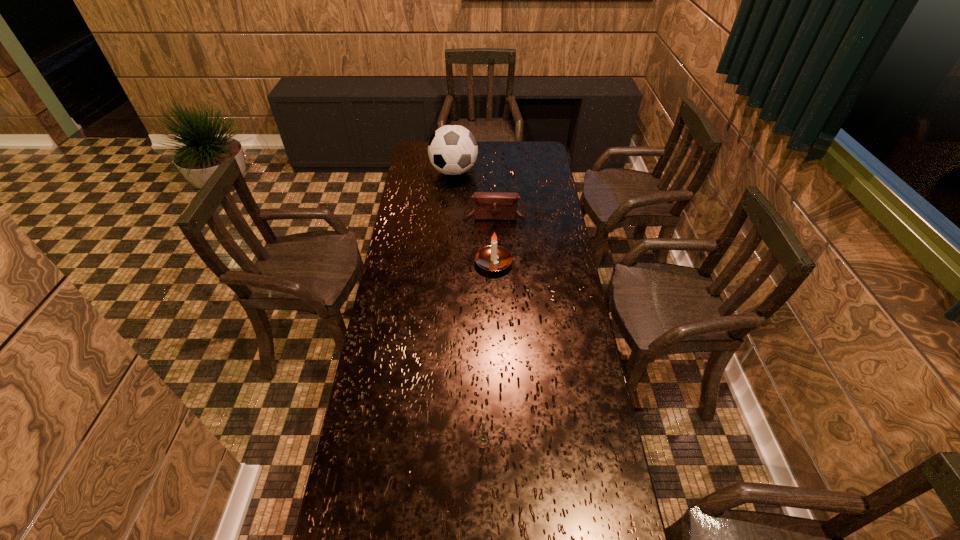
This screenshot has height=540, width=960. What are the coordinates of `vacant space located on the left of the nearest object` in the screenshot? It's located at (436, 442).

Where is `object located in the far edge section of the desktop`? object located in the far edge section of the desktop is located at coordinates point(452,149).

Find the location of a particular element. object located in the left edge section of the desktop is located at coordinates (452, 149).

Where is `object that is at the far left corner`? object that is at the far left corner is located at coordinates (x=452, y=149).

The height and width of the screenshot is (540, 960). In order to click on free spot at the left edge of the desktop in this screenshot , I will do pos(367,511).

Find the location of `free point at the right edge`. free point at the right edge is located at coordinates (591, 359).

Where is `vacant region at the far right corner`? The width and height of the screenshot is (960, 540). vacant region at the far right corner is located at coordinates (518, 145).

Where is `vacant space in between the shorter candle and the third nearest object`? This screenshot has width=960, height=540. vacant space in between the shorter candle and the third nearest object is located at coordinates (490, 329).

Identify the location of vacant region between the shorter candle and the soccer ball. (468, 307).

Find the location of `vacant area that lies between the taller candle and the farthest object`. vacant area that lies between the taller candle and the farthest object is located at coordinates (473, 218).